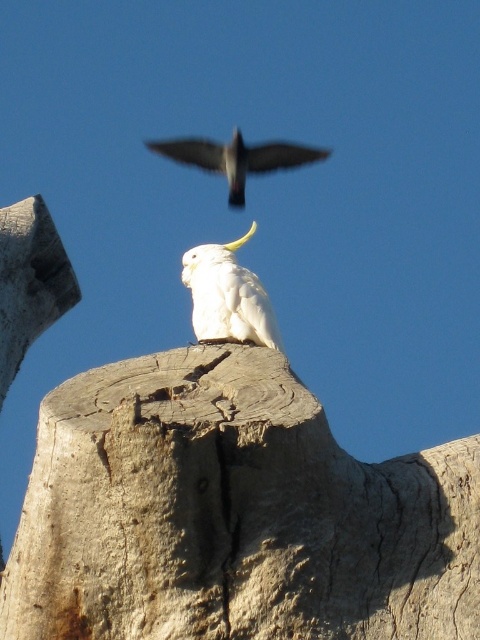
Is point (194, 273) less distant than point (192, 161)?

Yes, point (194, 273) is in front of point (192, 161).

How distant is white matte parrot at center from matte black bird at upper center?

white matte parrot at center is 10.90 meters away from matte black bird at upper center.

Measure the distance between white matte parrot at center and camera.

white matte parrot at center is 40.63 meters away from camera.

Where is `white matte parrot at center`? This screenshot has height=640, width=480. white matte parrot at center is located at coordinates (228, 296).

Is point (95, 454) more distant than point (177, 156)?

No, it is not.

This screenshot has height=640, width=480. What do you see at coordinates (232, 515) in the screenshot?
I see `light brown rough wood at center` at bounding box center [232, 515].

Where is `light brown rough wood at center`? Image resolution: width=480 pixels, height=640 pixels. light brown rough wood at center is located at coordinates (232, 515).

Between light brown rough wood at center and white matte parrot at center, which one appears on the left side from the viewer's perspective?

white matte parrot at center

Does light brown rough wood at center have a larger size compared to white matte parrot at center?

Actually, light brown rough wood at center might be smaller than white matte parrot at center.

The image size is (480, 640). What do you see at coordinates (232, 515) in the screenshot?
I see `light brown rough wood at center` at bounding box center [232, 515].

Identify the location of light brown rough wood at center. This screenshot has height=640, width=480. (232, 515).